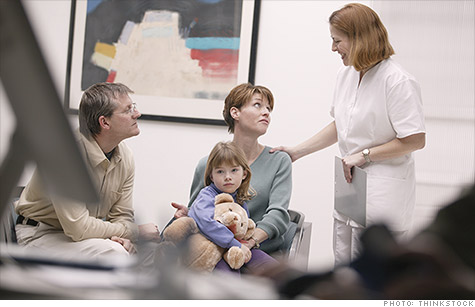
You are a GUI agent. You are given a task and a screenshot of the screen. Output one action in this format:
    pyautogui.click(x=<x>, y=<y>)
    Task: Click on the teddy bear
    
    Given the screenshot: What is the action you would take?
    pyautogui.click(x=236, y=210)